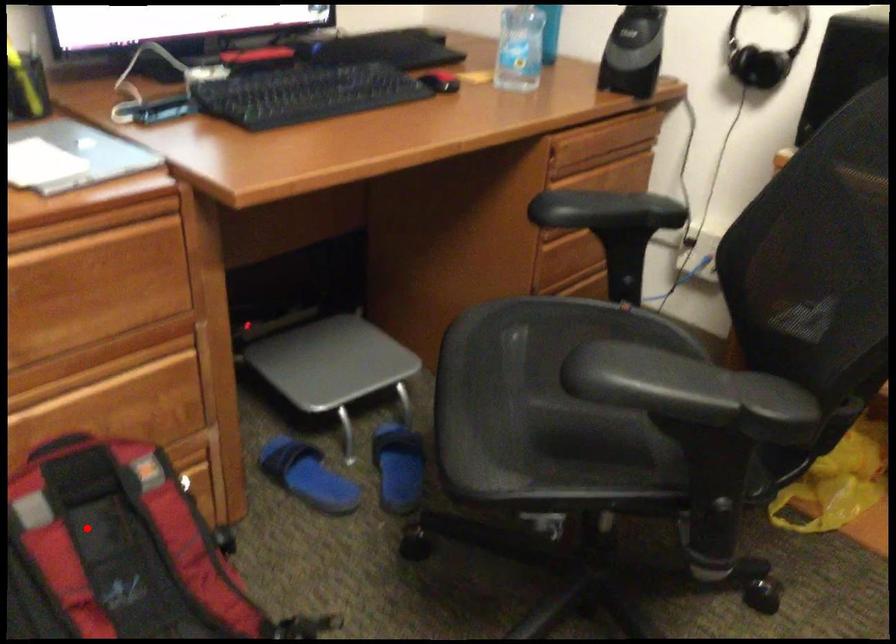
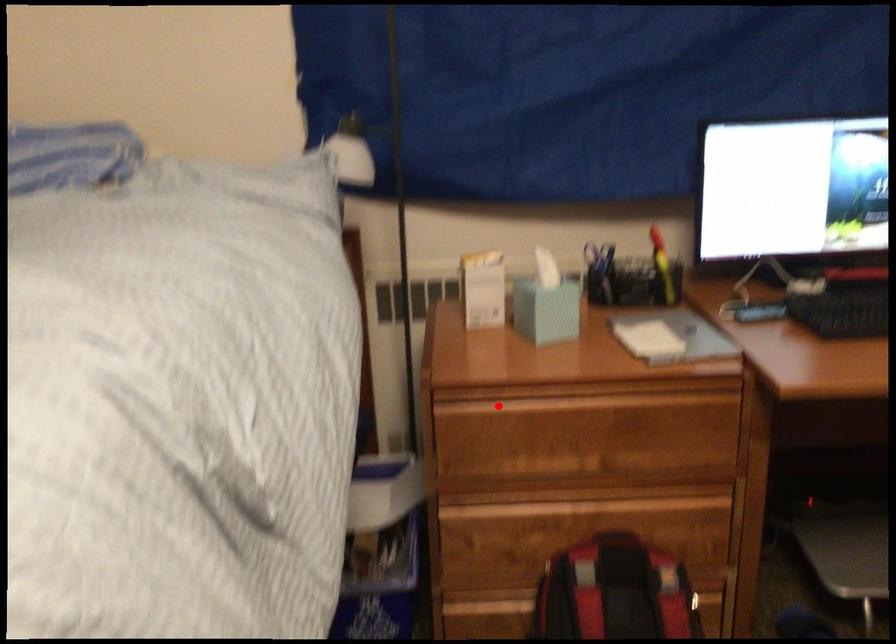
I am providing you with two images of the same scene from different viewpoints. A red point is marked on the first image and another point is marked on the second image. Is the red point in image1 aligned with the point shown in image2?

No